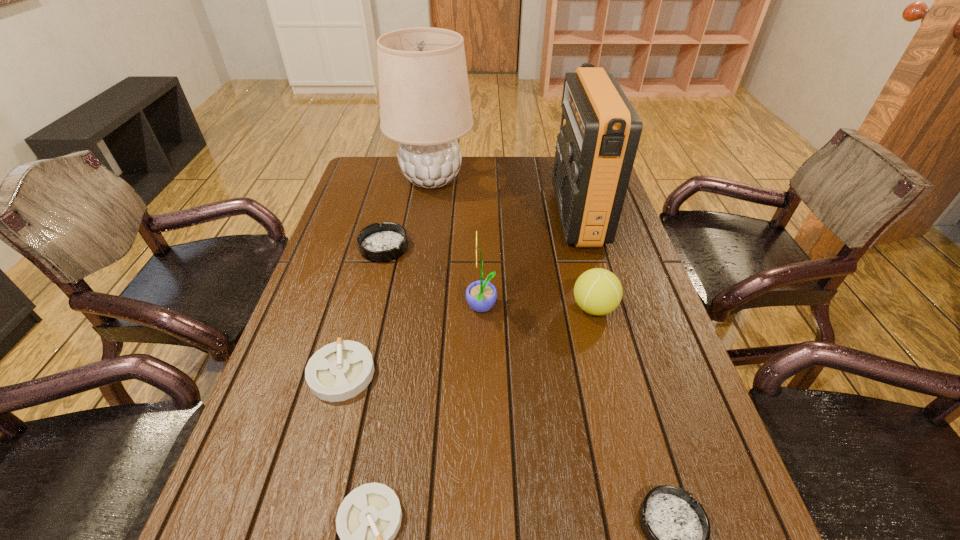
Image resolution: width=960 pixels, height=540 pixels. I want to click on free point between the third nearest ashtray and the radio receiver, so click(x=460, y=294).

You are a GUI agent. You are given a task and a screenshot of the screen. Output one action in this format:
    pyautogui.click(x=<x>, y=<y>)
    Task: Click on the blank region between the lampshade and the sunflower
    This screenshot has height=540, width=960.
    Given the screenshot: What is the action you would take?
    pyautogui.click(x=457, y=244)

This screenshot has height=540, width=960. In order to click on vacant area between the farther gray ashtray and the farthest ashtray in this screenshot , I will do `click(363, 310)`.

Locate an element on the screen. The width and height of the screenshot is (960, 540). empty space that is in between the lampshade and the radio receiver is located at coordinates (505, 197).

Identify which object is the second closest to the right dark ashtray. Please provide its 2D coordinates. Your answer should be formatted as a tuple, i.e. [(x, y)], where the tuple contains the x and y coordinates of a point satisfying the conditions above.

[(368, 519)]

Find the location of `object that ranks as the third closest to the radio receiver`. object that ranks as the third closest to the radio receiver is located at coordinates (425, 105).

Locate an element on the screen. The height and width of the screenshot is (540, 960). the second closest ashtray to the rightmost ashtray is located at coordinates (338, 371).

Point out which ashtray is positioned as the third nearest to the lampshade. Please provide its 2D coordinates. Your answer should be formatted as a tuple, i.e. [(x, y)], where the tuple contains the x and y coordinates of a point satisfying the conditions above.

[(368, 519)]

You are a GUI agent. You are given a task and a screenshot of the screen. Output one action in this format:
    pyautogui.click(x=<x>, y=<y>)
    Task: Click on the blank area in the image that satisfies the following two spatial constraints: 1. on the back side of the third nearest object; 2. on the right side of the lampshade
    This screenshot has height=540, width=960.
    Given the screenshot: What is the action you would take?
    pyautogui.click(x=395, y=179)